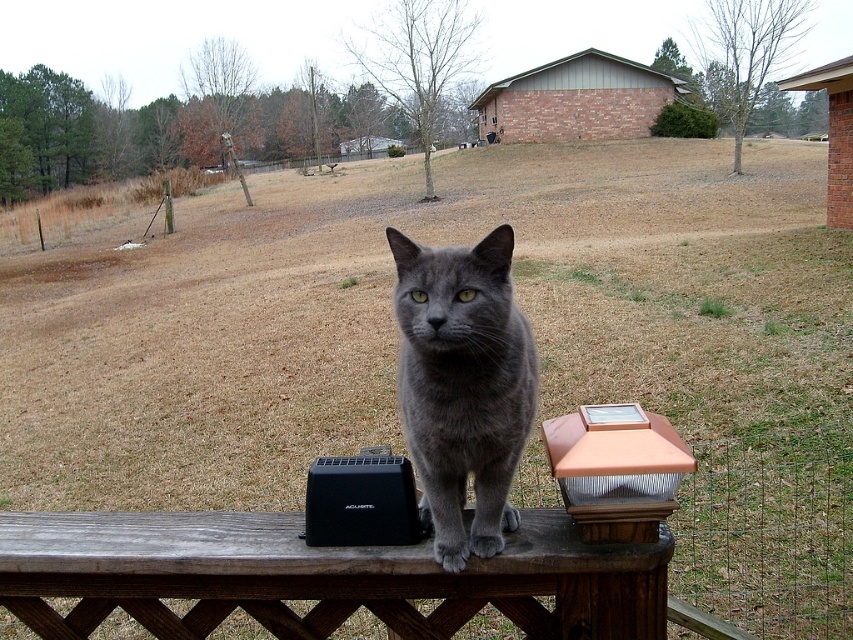
You are a painter setting up your easel to paint the wooden bench at center and the copper metallic solar light post at center. You want to ensure your painting accurately reflects their sizes. Which object should you draw wider in your artwork?

You should draw the wooden bench at center wider than the copper metallic solar light post at center because the wooden bench at center is wider than the copper metallic solar light post at center according to the description.

You are a small robot with a width of 12 inches. You need to move from the wooden bench at center to the gray matte fur cat at center. Can you pass through the space between them without touching either?

The wooden bench at center and gray matte fur cat at center are 13.89 inches apart from each other. Since your width is 12 inches, you can pass through the space between them without touching either.

You are a photographer trying to capture the gray matte fur cat at center and the copper metallic solar light post at center in a single frame. If you want to ensure both subjects are in focus, which subject should you position closer to the camera?

The gray matte fur cat at center is larger in size than the copper metallic solar light post at center, so to ensure both are in focus, position the gray matte fur cat at center closer to the camera since it is bigger and requires more detail.